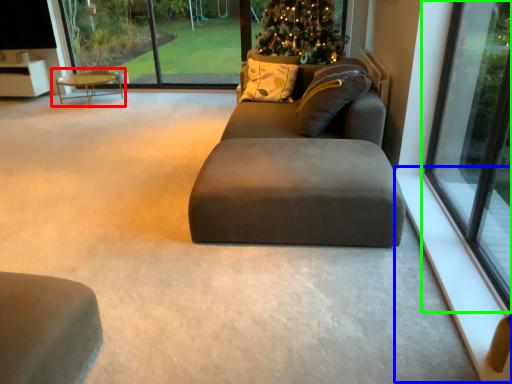
Question: Estimate the real-world distances between objects in this image. Which object is farther from coffee table (highlighted by a red box), window sill (highlighted by a blue box) or window (highlighted by a green box)?

Choices:
 (A) window sill
 (B) window

Answer: (A)